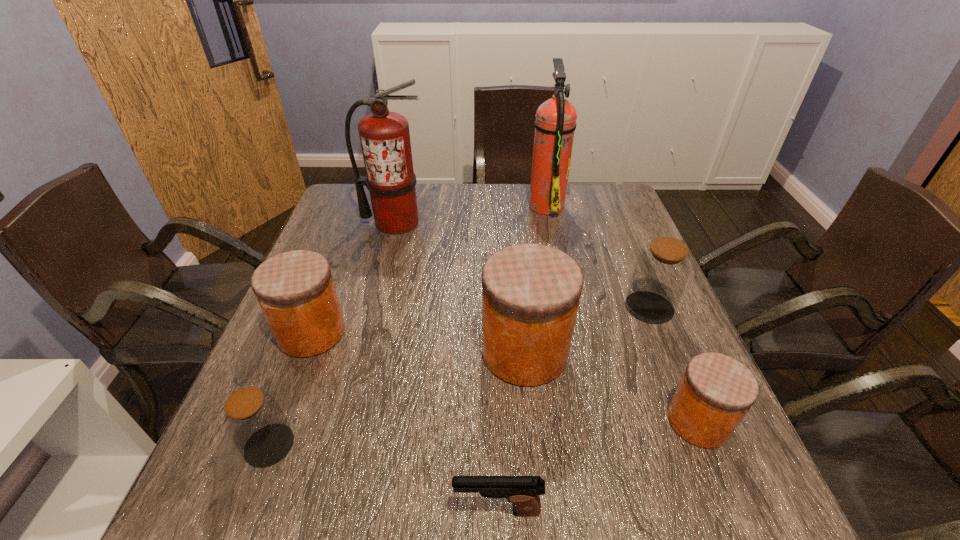
Where is `the smaller brown jar`? The image size is (960, 540). the smaller brown jar is located at coordinates (254, 421).

What are the coordinates of `the nearest object` in the screenshot? It's located at (523, 491).

The height and width of the screenshot is (540, 960). Find the location of `pistol`. pistol is located at coordinates (523, 491).

Where is `blank area located at the nozzle of the right fire extinguisher`? This screenshot has height=540, width=960. blank area located at the nozzle of the right fire extinguisher is located at coordinates (506, 205).

Identify the location of vacant space positioned at the nozzle of the right fire extinguisher. pyautogui.click(x=459, y=205).

Where is `vacant space located 0.070m at the nozzle of the right fire extinguisher`? vacant space located 0.070m at the nozzle of the right fire extinguisher is located at coordinates (506, 205).

Find the location of `vacant space positioned 0.390m toward the nozzle of the red fire extinguisher`. vacant space positioned 0.390m toward the nozzle of the red fire extinguisher is located at coordinates [x=366, y=339].

The image size is (960, 540). In order to click on vacant region located on the back of the third jar from left to right in this screenshot , I will do `click(518, 286)`.

Where is `vacant position located 0.200m on the front of the second smallest orange jar`? The image size is (960, 540). vacant position located 0.200m on the front of the second smallest orange jar is located at coordinates (268, 448).

Identify the location of blank area located 0.130m on the back of the bigger brown jar. (630, 259).